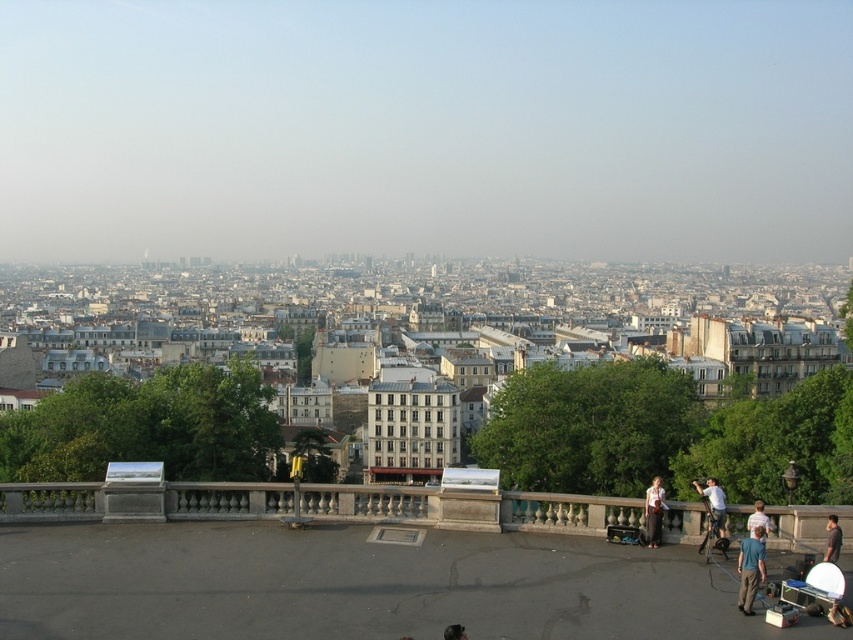
Question: Does silver metallic stroller at lower right appear under blue fabric shirt at lower right?

Choices:
 (A) yes
 (B) no

Answer: (A)

Question: Considering the real-world distances, which object is farthest from the silver metallic stroller at lower right?

Choices:
 (A) blue fabric shirt at lower right
 (B) light brown leather jacket at lower right
 (C) gray fabric bag at lower right

Answer: (B)

Question: Which point is closer to the camera taking this photo?

Choices:
 (A) [833, 522]
 (B) [709, 477]
 (C) [766, 529]
 (D) [645, 506]

Answer: (A)

Question: Observing the image, what is the correct spatial positioning of blue fabric shirt at lower right in reference to white cotton shirt at lower right?

Choices:
 (A) below
 (B) above

Answer: (A)

Question: Which object appears farthest from the camera in this image?

Choices:
 (A) light brown leather jacket at lower right
 (B) blue fabric shirt at lower right
 (C) gray fabric bag at lower right

Answer: (A)

Question: Does blue fabric shirt at lower right have a larger size compared to smooth leather jacket at lower center?

Choices:
 (A) yes
 (B) no

Answer: (A)